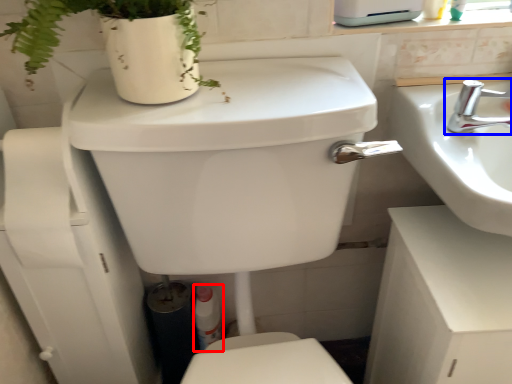
Question: Which of the following is the closest to the observer, toiletry (highlighted by a red box) or tap (highlighted by a blue box)?

Choices:
 (A) toiletry
 (B) tap

Answer: (B)